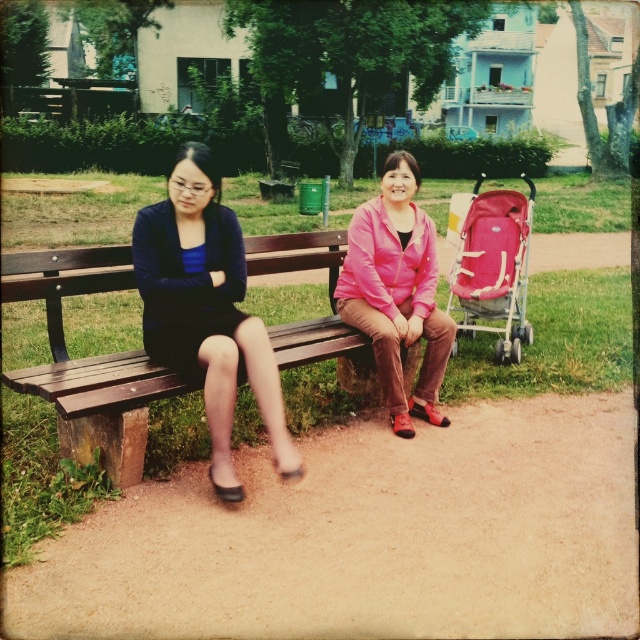
You are standing at the origin point of the park map. The park map uses a coordinate system where the bottom left corner is the origin. You want to find the wooden bench at center. What are its coordinates?

The wooden bench at center is located at coordinates point (88, 362).